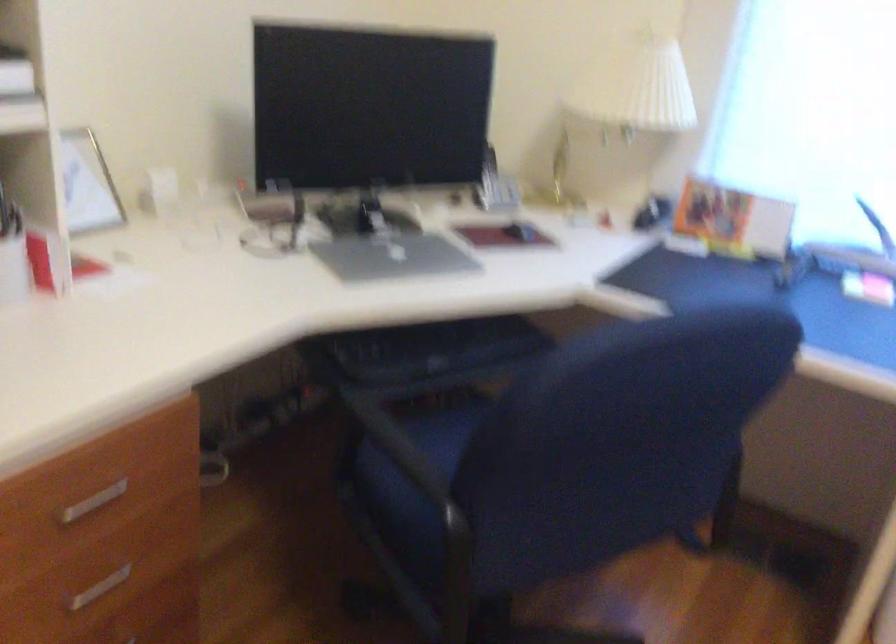
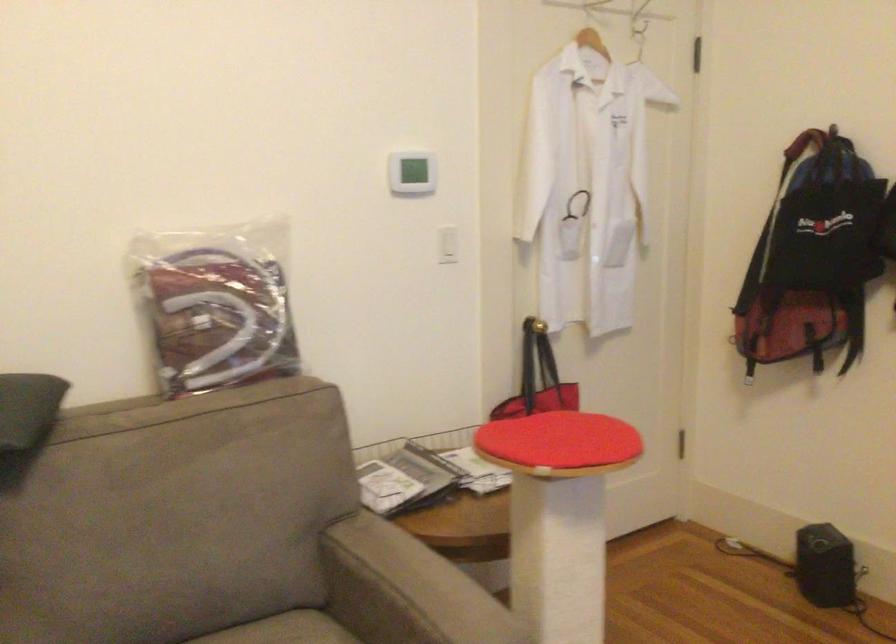
Question: The camera is either moving clockwise (left) or counter-clockwise (right) around the object. The first image is from the beginning of the video and the second image is from the end. Is the camera moving left or right when shooting the video?

Choices:
 (A) Left
 (B) Right

Answer: (B)